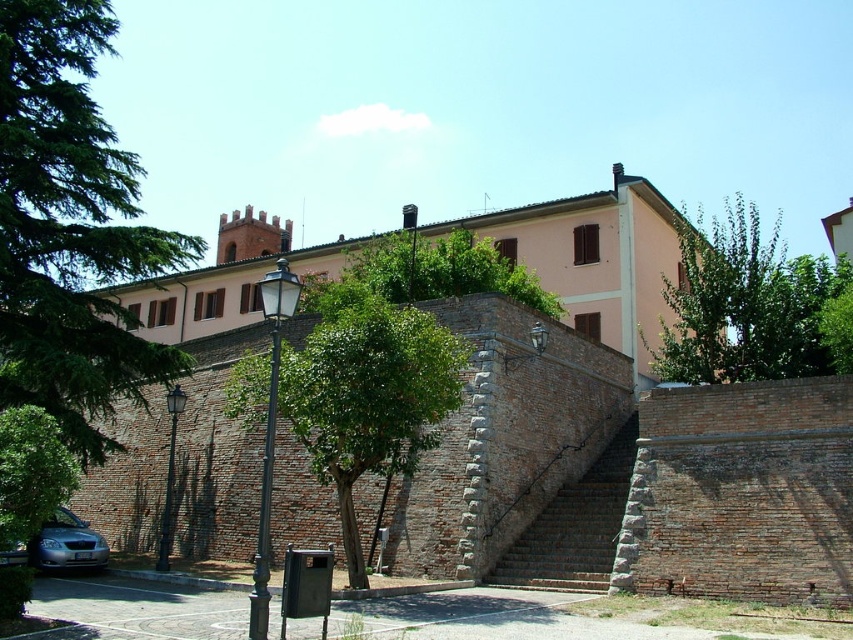
What do you see at coordinates (70, 228) in the screenshot?
I see `green leafy tree at left` at bounding box center [70, 228].

Who is more forward, [85,314] or [560,509]?

Positioned in front is point [560,509].

I want to click on green leafy tree at left, so click(x=70, y=228).

How distant is green leafy tree at center from silver metallic car at lower left?

They are 13.28 meters apart.

Which is behind, point (357, 557) or point (78, 541)?

Positioned behind is point (78, 541).

The width and height of the screenshot is (853, 640). Identify the location of green leafy tree at center. (367, 394).

Is green leafy tree at left to the right of green leafy tree at upper right from the viewer's perspective?

No, green leafy tree at left is not to the right of green leafy tree at upper right.

Is green leafy tree at left to the left of green leafy tree at upper right from the viewer's perspective?

Correct, you'll find green leafy tree at left to the left of green leafy tree at upper right.

Describe the element at coordinates (70, 228) in the screenshot. This screenshot has width=853, height=640. I see `green leafy tree at left` at that location.

I want to click on green leafy tree at left, so click(x=70, y=228).